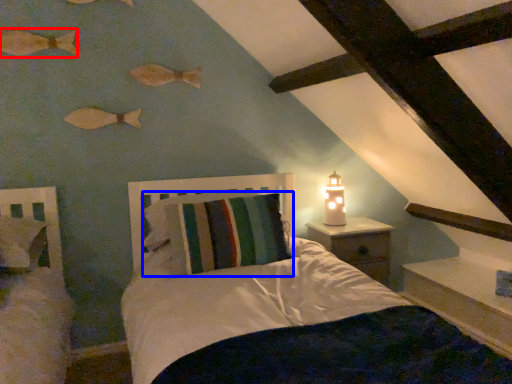
Question: Which of the following is the closest to the observer, fish (highlighted by a red box) or pillow (highlighted by a blue box)?

Choices:
 (A) fish
 (B) pillow

Answer: (B)